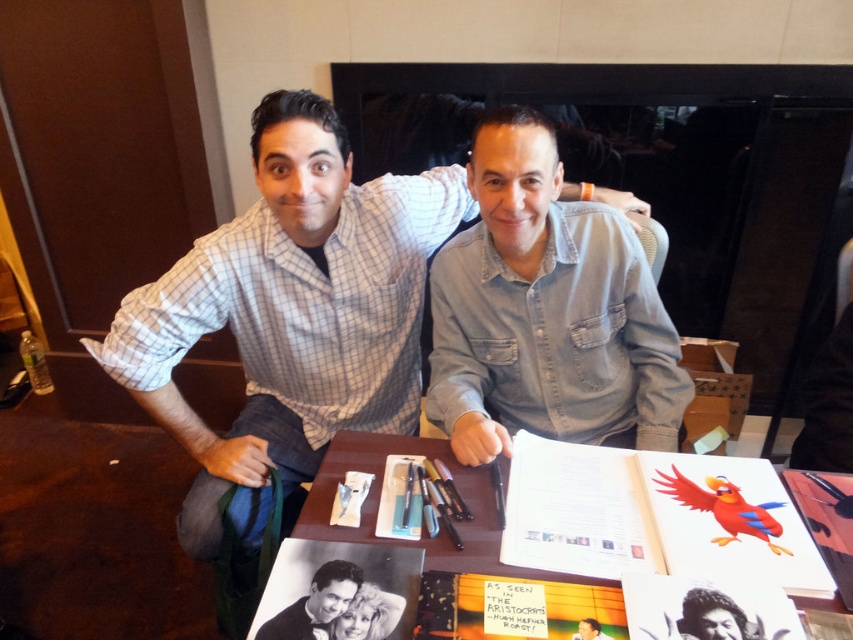
Is wooden table at center to the left of matte black bow tie at center from the viewer's perspective?

Incorrect, wooden table at center is not on the left side of matte black bow tie at center.

Which is above, wooden table at center or matte black bow tie at center?

wooden table at center is above.

Is point (483, 492) behind point (343, 605)?

Yes.

This screenshot has width=853, height=640. I want to click on wooden table at center, so click(422, 529).

Consider the image. Does denim shirt at center come in front of matte black bow tie at center?

No, it is not.

Who is more forward, (480, 461) or (282, 625)?

Positioned in front is point (282, 625).

Where is `denim shirt at center`? The height and width of the screenshot is (640, 853). denim shirt at center is located at coordinates (546, 310).

Locate an element on the screen. The height and width of the screenshot is (640, 853). denim shirt at center is located at coordinates (546, 310).

Is white checkered shirt at upper left positioned in front of denim shirt at center?

No, white checkered shirt at upper left is behind denim shirt at center.

Does white checkered shirt at upper left appear over denim shirt at center?

Actually, white checkered shirt at upper left is below denim shirt at center.

Does point (245, 429) come closer to viewer compared to point (664, 396)?

No.

This screenshot has width=853, height=640. Find the location of `white checkered shirt at upper left`. white checkered shirt at upper left is located at coordinates (291, 312).